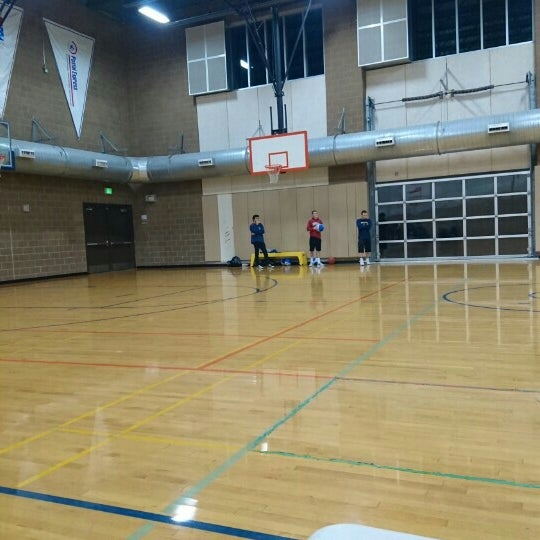
Locate an element on the screen. gray pipes is located at coordinates (417, 136).